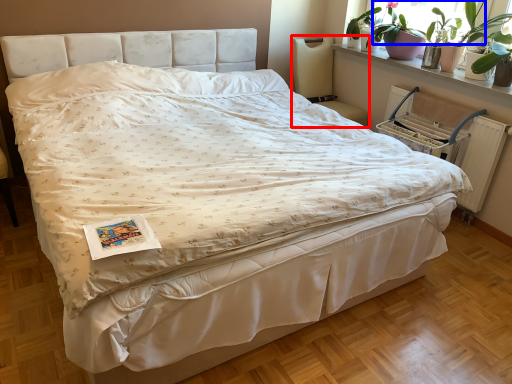
Question: Which object appears closest to the camera in this image, chair (highlighted by a red box) or window screen (highlighted by a blue box)?

Choices:
 (A) chair
 (B) window screen

Answer: (B)